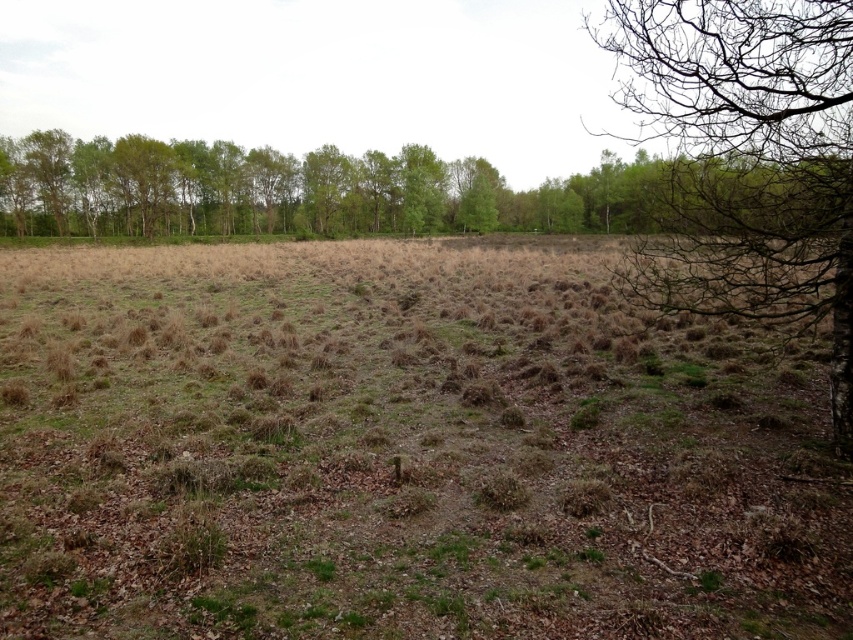
Question: Does brown grassy field at center have a greater width compared to bare branches at right?

Choices:
 (A) no
 (B) yes

Answer: (A)

Question: Does bare branches at right appear under green leafy trees at upper center?

Choices:
 (A) no
 (B) yes

Answer: (A)

Question: Among these points, which one is farthest from the camera?

Choices:
 (A) (770, 220)
 (B) (779, 177)
 (C) (61, 348)

Answer: (C)

Question: Which object is the closest to the bare branches at right?

Choices:
 (A) brown grassy field at center
 (B) green leafy trees at upper center

Answer: (A)

Question: Which of the following is the farthest from the observer?

Choices:
 (A) bare branches at right
 (B) green leafy trees at upper center
 (C) brown grassy field at center

Answer: (B)

Question: Does brown grassy field at center have a greater width compared to green leafy trees at upper center?

Choices:
 (A) yes
 (B) no

Answer: (B)